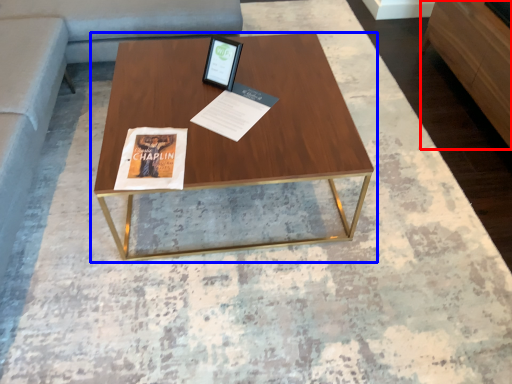
Question: Which of the following is the closest to the observer, furniture (highlighted by a red box) or coffee table (highlighted by a blue box)?

Choices:
 (A) furniture
 (B) coffee table

Answer: (B)